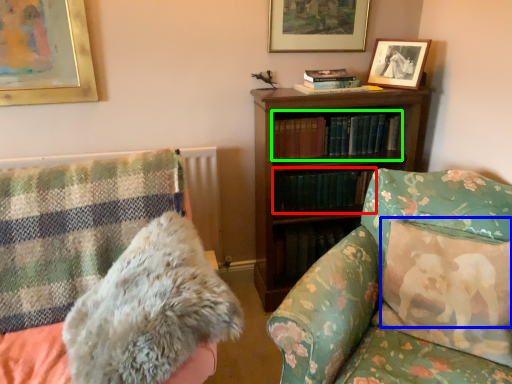
Question: Which object is positioned farthest from book (highlighted by a red box)? Select from pillow (highlighted by a blue box) and book (highlighted by a green box).

Choices:
 (A) pillow
 (B) book

Answer: (A)